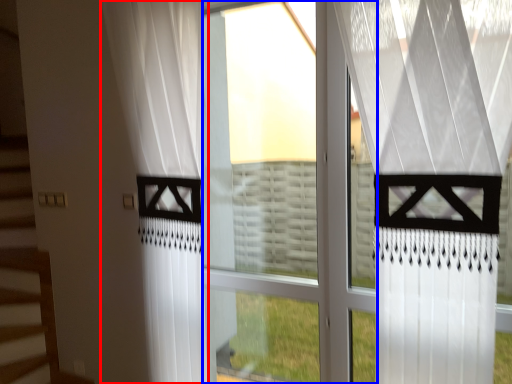
Question: Which point is further to the camera, curtain (highlighted by a red box) or glass window (highlighted by a blue box)?

Choices:
 (A) curtain
 (B) glass window

Answer: (B)